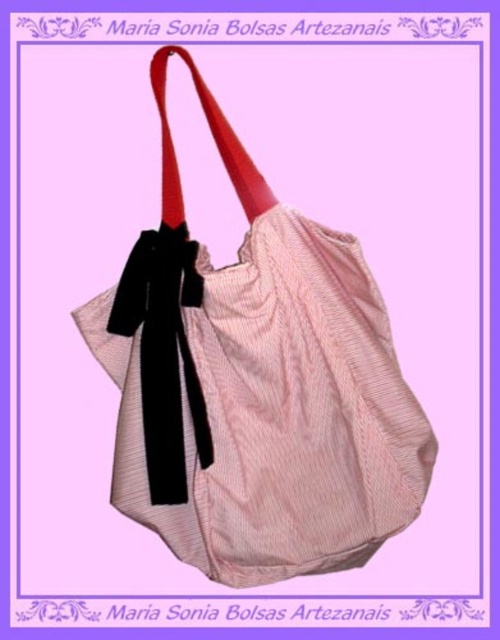
You are standing 1.5 meters away from the tote bag. A point on the tote bag is located at coordinates point (259,394). Can you reach this point with your hand without moving closer to the bag?

The distance of point (259,394) from the viewer is 1.28 meters. Since you are standing 1.5 meters away, the point is closer to you than your current position. Therefore, you can reach it without moving closer.

You are a photographer trying to focus on two points on the tote bag. The first point is at coordinates point (x=144, y=248) and the second is at point (x=149, y=440). Which point should you adjust your camera focus to first to ensure it is closer to you?

Point (x=144, y=248) is further to the camera than point (x=149, y=440), so you should focus on point (x=144, y=248) first since it is closer to you.